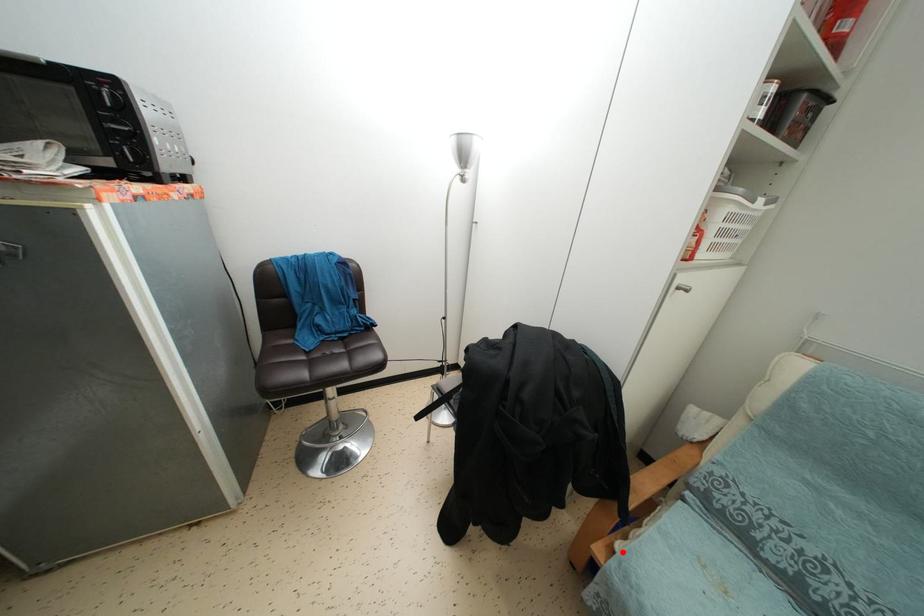
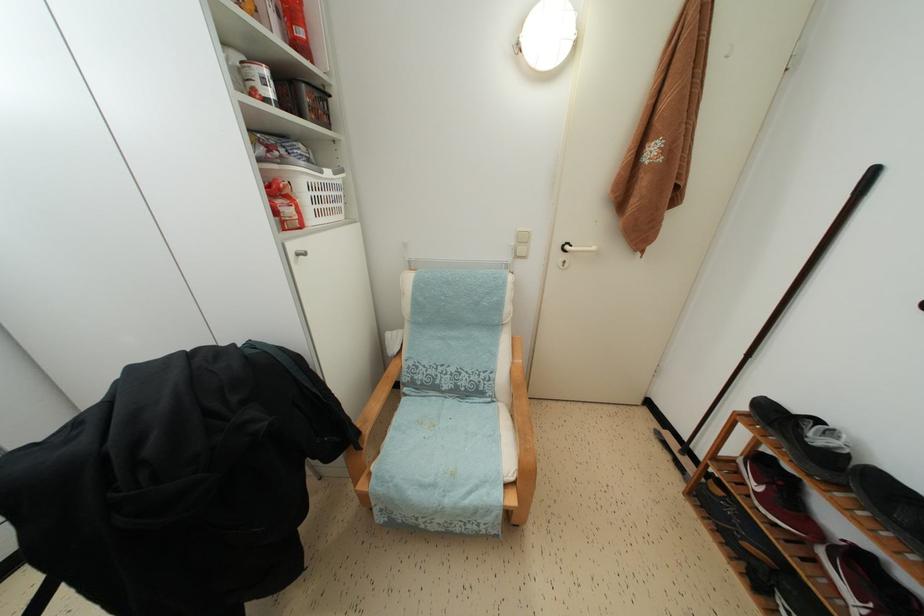
In the second image, find the point that corresponds to the highlighted location in the first image.

(377, 472)